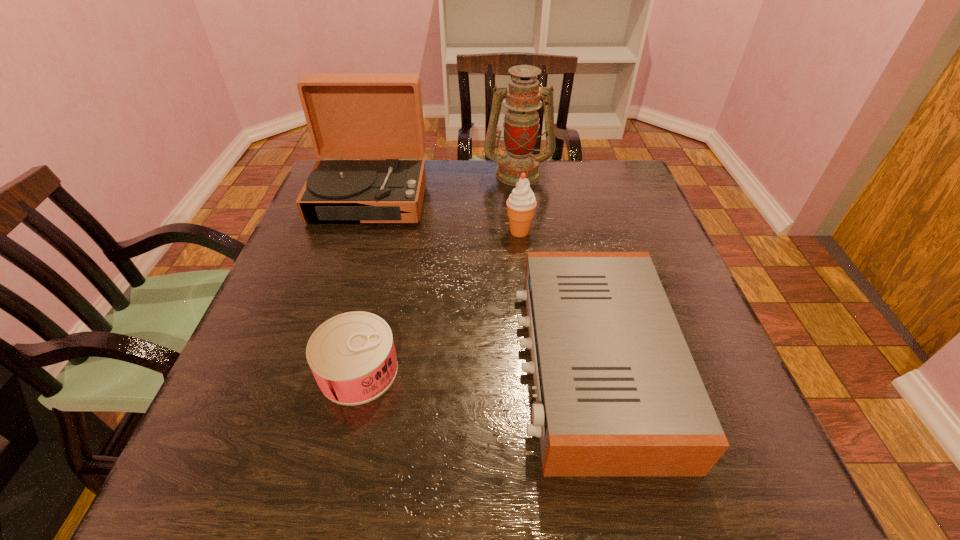
I want to click on empty location between the radio receiver and the phonograph record, so click(482, 281).

This screenshot has width=960, height=540. In order to click on the third closest object to the shortest object in this screenshot , I will do `click(521, 204)`.

I want to click on object that is the fourth closest to the oil lamp, so click(x=352, y=356).

At what (x,y) coordinates should I click in order to perform the action: click on free spot that satisfies the following two spatial constraints: 1. on the face of the phonograph record; 2. on the left side of the icecream. Please return your answer as a coordinate pair (x, y). This screenshot has width=960, height=540. Looking at the image, I should click on (359, 232).

Where is `free space that satisfies the following two spatial constraints: 1. on the face of the phonograph record; 2. on the right side of the shortest object`? Image resolution: width=960 pixels, height=540 pixels. free space that satisfies the following two spatial constraints: 1. on the face of the phonograph record; 2. on the right side of the shortest object is located at coordinates (316, 370).

Image resolution: width=960 pixels, height=540 pixels. What are the coordinates of `free location that satisfies the following two spatial constraints: 1. on the face of the shortest object; 2. on the left side of the phonograph record` in the screenshot? It's located at (316, 370).